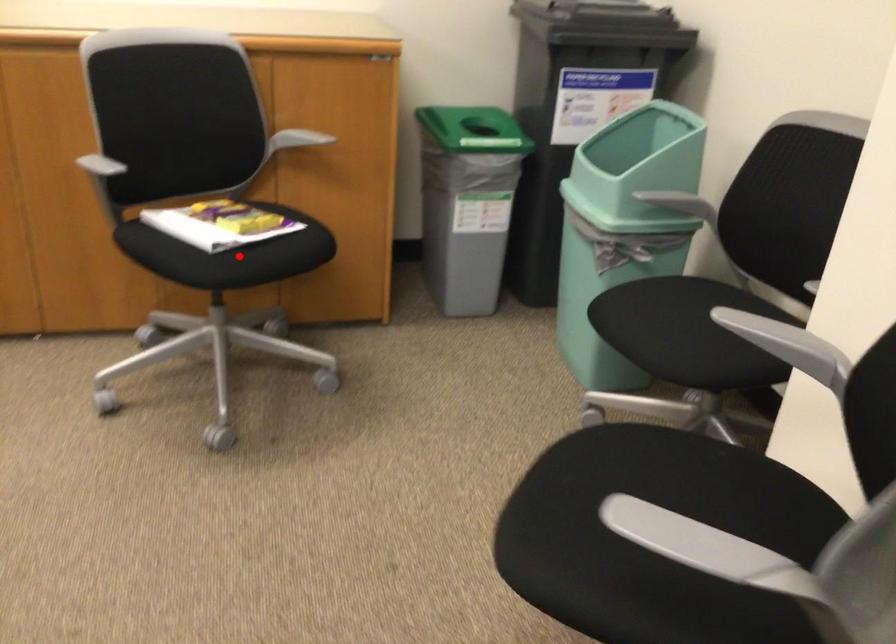
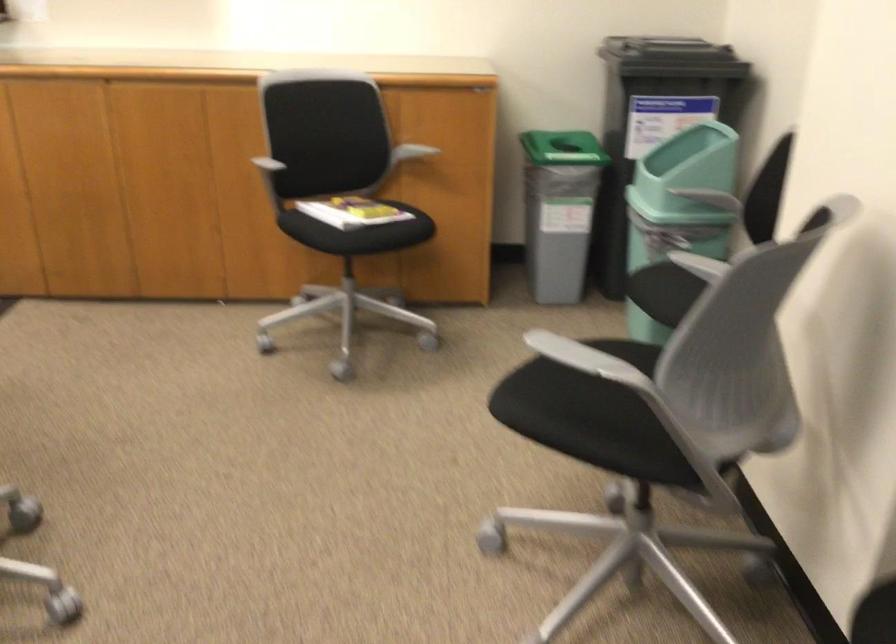
Question: A red point is marked in image1. In image2, is the corresponding 3D point closer to the camera or farther? Reply with the corresponding letter.

Choices:
 (A) The corresponding 3D point is closer.
 (B) The corresponding 3D point is farther.

Answer: (B)